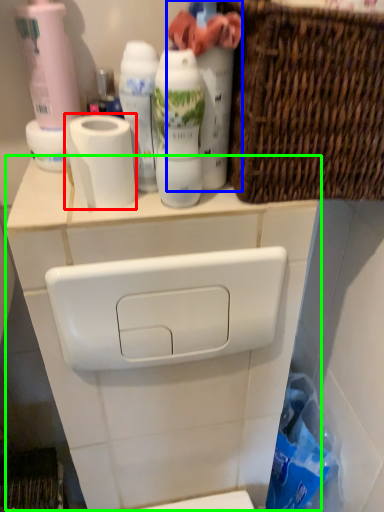
Question: Which is nearer to the toilet paper (highlighted by a red box)? cleaning product (highlighted by a blue box) or counter (highlighted by a green box).

Choices:
 (A) cleaning product
 (B) counter

Answer: (A)